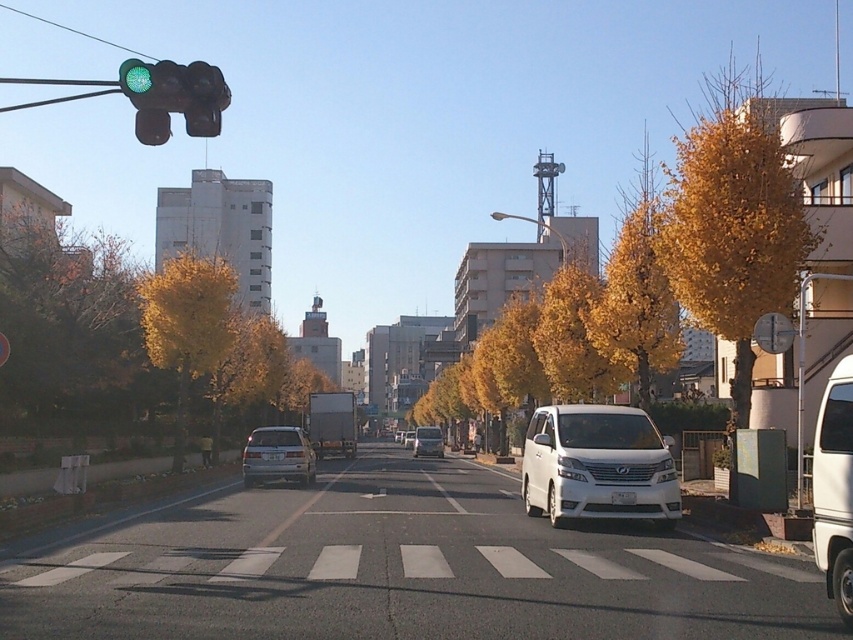
You are a pedestrian waiting to cross the street at the white glossy car at center. You need to reach the white matte van at right. Is there a direct path between them, or will you have to go around?

The white glossy car at center is positioned under the white matte van at right, so there is no direct path between them. You will have to go around either the white glossy car at center or the white matte van at right to reach your destination.

You are a pedestrian waiting at the crosswalk. You see the green glass traffic light at upper left and the white glossy van at center. Which object is bigger in the image?

The green glass traffic light at upper left is larger in size than the white glossy van at center.